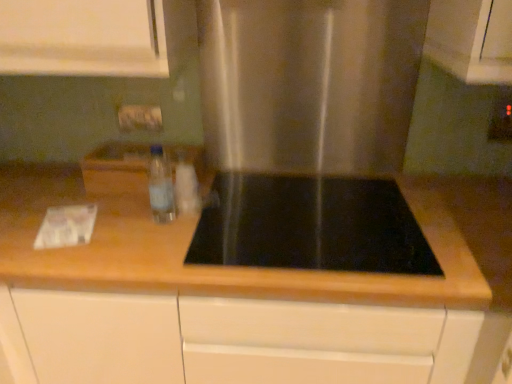
Question: Considering the relative sizes of translucent plastic bottle at center, acting as the second bottle starting from the left, and matte plastic electric outlet at upper right in the image provided, is translucent plastic bottle at center, acting as the second bottle starting from the left, taller than matte plastic electric outlet at upper right?

Choices:
 (A) no
 (B) yes

Answer: (A)

Question: Does translucent plastic bottle at center, acting as the second bottle starting from the left, have a greater width compared to matte plastic electric outlet at upper right?

Choices:
 (A) yes
 (B) no

Answer: (A)

Question: Is translucent plastic bottle at center, the 1th bottle in the right-to-left sequence, not close to matte plastic electric outlet at upper right?

Choices:
 (A) yes
 (B) no

Answer: (A)

Question: Is translucent plastic bottle at center, the 1th bottle in the right-to-left sequence, thinner than matte plastic electric outlet at upper right?

Choices:
 (A) yes
 (B) no

Answer: (B)

Question: Is translucent plastic bottle at center, acting as the second bottle starting from the left, at the right side of matte plastic electric outlet at upper right?

Choices:
 (A) no
 (B) yes

Answer: (A)

Question: Is translucent plastic bottle at center, the 1th bottle in the right-to-left sequence, facing towards matte plastic electric outlet at upper right?

Choices:
 (A) yes
 (B) no

Answer: (B)

Question: Is matte plastic electric outlet at upper right beside clear plastic bottle at center, placed as the first bottle when sorted from left to right?

Choices:
 (A) no
 (B) yes

Answer: (A)

Question: Can you confirm if matte plastic electric outlet at upper right is wider than clear plastic bottle at center, the second bottle viewed from the right?

Choices:
 (A) yes
 (B) no

Answer: (B)

Question: Is matte plastic electric outlet at upper right taller than clear plastic bottle at center, placed as the first bottle when sorted from left to right?

Choices:
 (A) yes
 (B) no

Answer: (B)

Question: Is the position of matte plastic electric outlet at upper right more distant than that of clear plastic bottle at center, the second bottle viewed from the right?

Choices:
 (A) no
 (B) yes

Answer: (B)

Question: From the image's perspective, is matte plastic electric outlet at upper right located above clear plastic bottle at center, the second bottle viewed from the right?

Choices:
 (A) no
 (B) yes

Answer: (B)

Question: Considering the relative sizes of matte plastic electric outlet at upper right and clear plastic bottle at center, the second bottle viewed from the right, in the image provided, is matte plastic electric outlet at upper right smaller than clear plastic bottle at center, the second bottle viewed from the right,?

Choices:
 (A) no
 (B) yes

Answer: (B)

Question: From the image's perspective, would you say translucent plastic bottle at center, the 1th bottle in the right-to-left sequence, is shown under wooden at center?

Choices:
 (A) yes
 (B) no

Answer: (B)